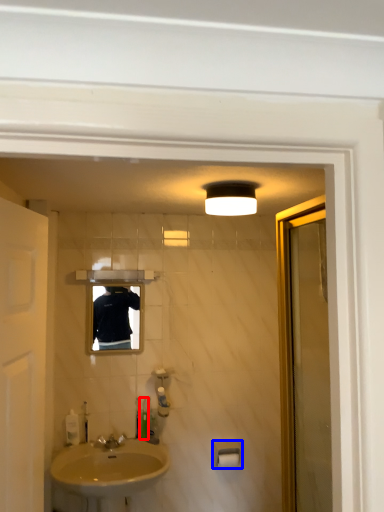
Question: Which point is closer to the camera, toiletry (highlighted by a red box) or towel bar (highlighted by a blue box)?

Choices:
 (A) toiletry
 (B) towel bar

Answer: (B)